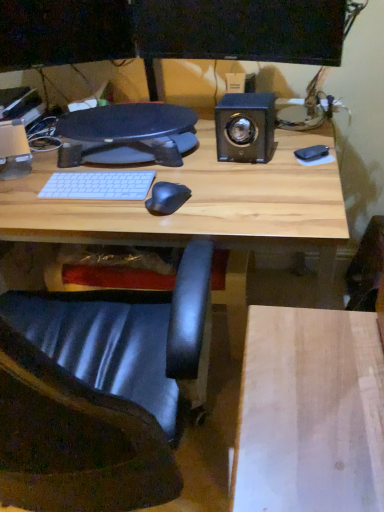
Question: Is point (246, 137) positioned closer to the camera than point (29, 325)?

Choices:
 (A) closer
 (B) farther

Answer: (B)

Question: Considering their positions, is metallic black speaker at upper right located in front of or behind black leather chair at lower left?

Choices:
 (A) behind
 (B) front

Answer: (A)

Question: From the image's perspective, is metallic black speaker at upper right above or below black leather chair at lower left?

Choices:
 (A) below
 (B) above

Answer: (B)

Question: Looking at their shapes, would you say black leather chair at lower left is wider or thinner than metallic black speaker at upper right?

Choices:
 (A) thin
 (B) wide

Answer: (B)

Question: From their relative heights in the image, would you say black leather chair at lower left is taller or shorter than metallic black speaker at upper right?

Choices:
 (A) tall
 (B) short

Answer: (A)

Question: Choose the correct answer: Is black leather chair at lower left inside metallic black speaker at upper right or outside it?

Choices:
 (A) outside
 (B) inside

Answer: (A)

Question: Considering the relative positions of black leather chair at lower left and metallic black speaker at upper right in the image provided, is black leather chair at lower left to the left or to the right of metallic black speaker at upper right?

Choices:
 (A) right
 (B) left

Answer: (B)